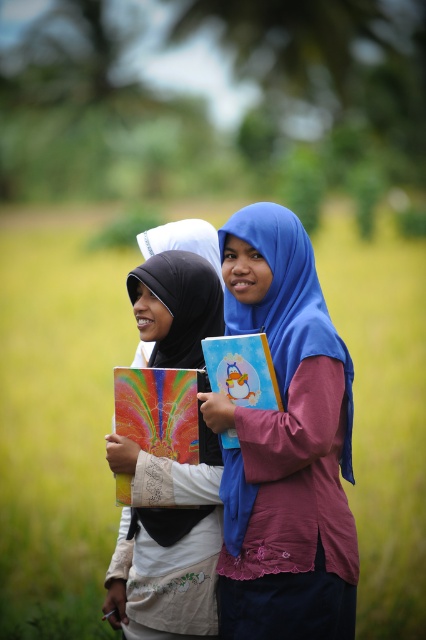
You are standing in a grassy field and see two points marked in the image. Which point is closer to you, point (152,380) or point (252,397)?

Point (252,397) is closer to you because it is in front of point (152,380).